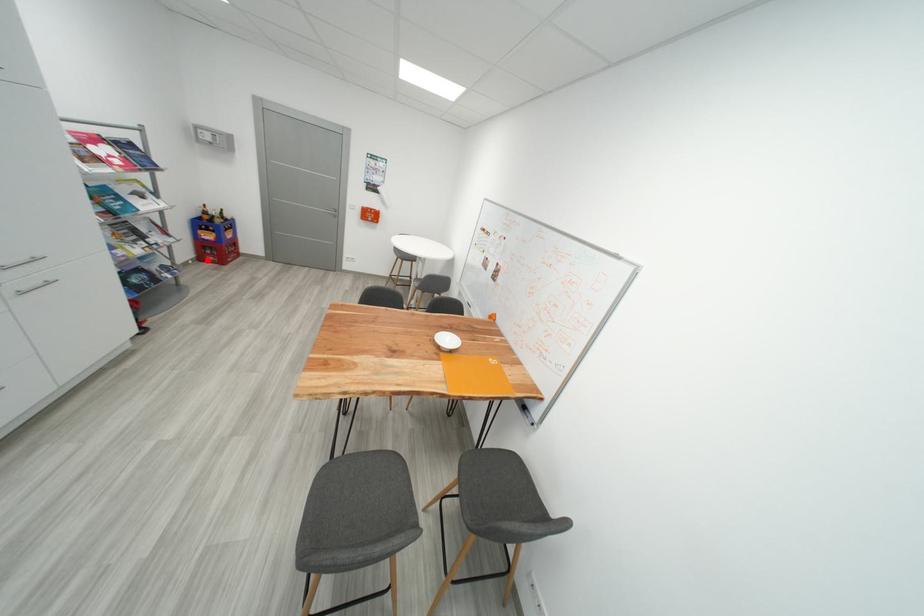
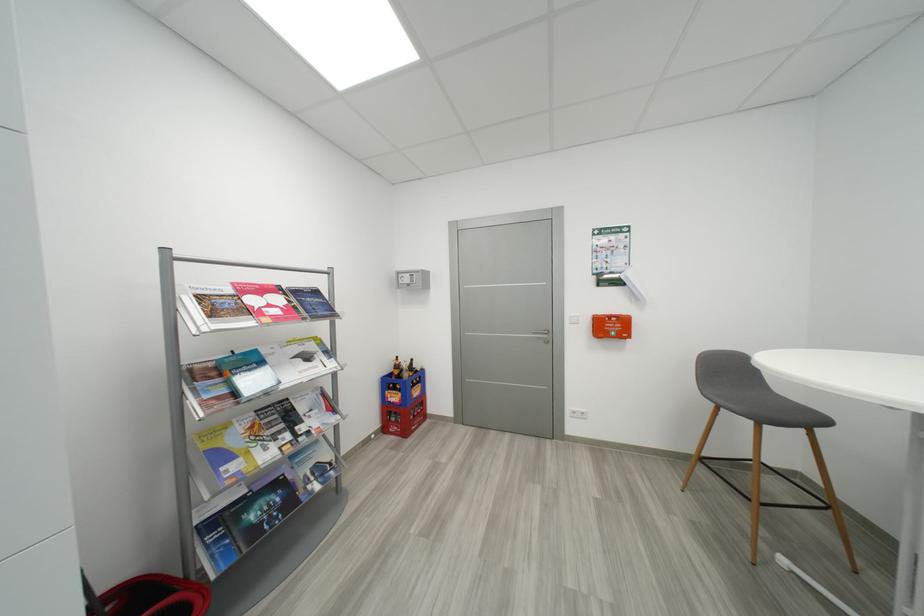
In the second image, find the point that corresponds to the highlighted location in the first image.

(392, 431)